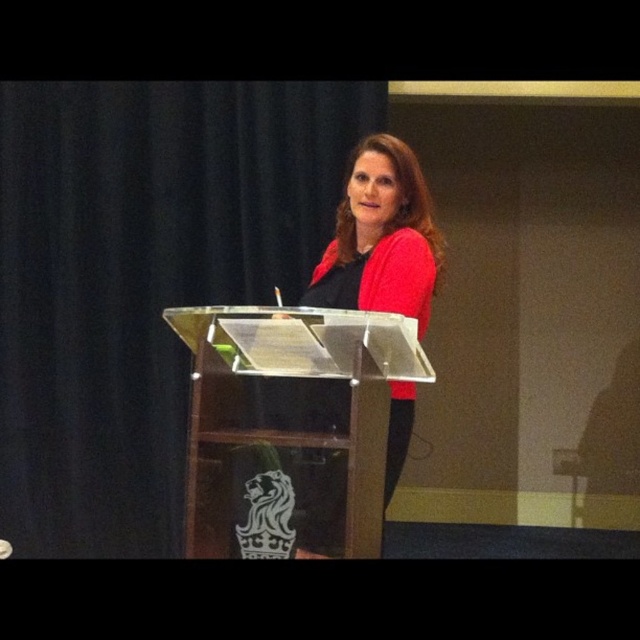
Can you confirm if clear acrylic podium at center is positioned above matte red sweater at center?

No.

Does point (262, 483) come behind point (353, 157)?

No, (262, 483) is closer to viewer.

Identify the location of clear acrylic podium at center. coord(291,426).

The width and height of the screenshot is (640, 640). Identify the location of clear acrylic podium at center. (291, 426).